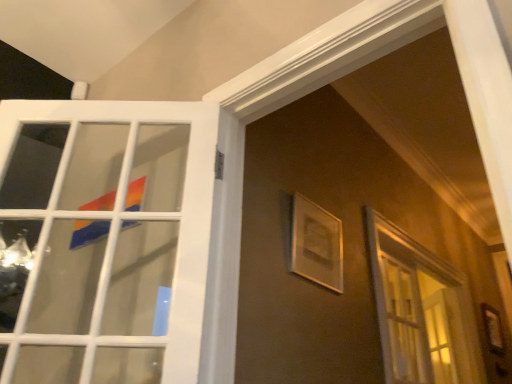
Question: Are white glossy door at upper left and matte white picture frame at upper center beside each other?

Choices:
 (A) no
 (B) yes

Answer: (A)

Question: From the image's perspective, is white glossy door at upper left under matte white picture frame at upper center?

Choices:
 (A) no
 (B) yes

Answer: (A)

Question: Is matte white picture frame at upper center at the back of white glossy door at upper left?

Choices:
 (A) yes
 (B) no

Answer: (B)

Question: Is white glossy door at upper left outside matte white picture frame at upper center?

Choices:
 (A) yes
 (B) no

Answer: (A)

Question: Considering the relative sizes of white glossy door at upper left and matte white picture frame at upper center in the image provided, is white glossy door at upper left shorter than matte white picture frame at upper center?

Choices:
 (A) no
 (B) yes

Answer: (A)

Question: From a real-world perspective, does white glossy door at upper left sit lower than matte white picture frame at upper center?

Choices:
 (A) yes
 (B) no

Answer: (A)

Question: Would you say matte white picture frame at upper center contains white glossy door at upper left?

Choices:
 (A) no
 (B) yes

Answer: (A)

Question: Is matte white picture frame at upper center directly adjacent to white glossy door at upper left?

Choices:
 (A) no
 (B) yes

Answer: (A)

Question: Considering the relative sizes of matte white picture frame at upper center and white glossy door at upper left in the image provided, is matte white picture frame at upper center thinner than white glossy door at upper left?

Choices:
 (A) yes
 (B) no

Answer: (A)

Question: Considering the relative positions of matte white picture frame at upper center and white glossy door at upper left in the image provided, is matte white picture frame at upper center to the right of white glossy door at upper left from the viewer's perspective?

Choices:
 (A) no
 (B) yes

Answer: (B)

Question: Considering the relative positions of matte white picture frame at upper center and white glossy door at upper left in the image provided, is matte white picture frame at upper center to the left of white glossy door at upper left from the viewer's perspective?

Choices:
 (A) no
 (B) yes

Answer: (A)

Question: Is matte white picture frame at upper center bigger than white glossy door at upper left?

Choices:
 (A) yes
 (B) no

Answer: (B)

Question: Is point coord(169,304) closer or farther from the camera than point coord(330,231)?

Choices:
 (A) farther
 (B) closer

Answer: (B)